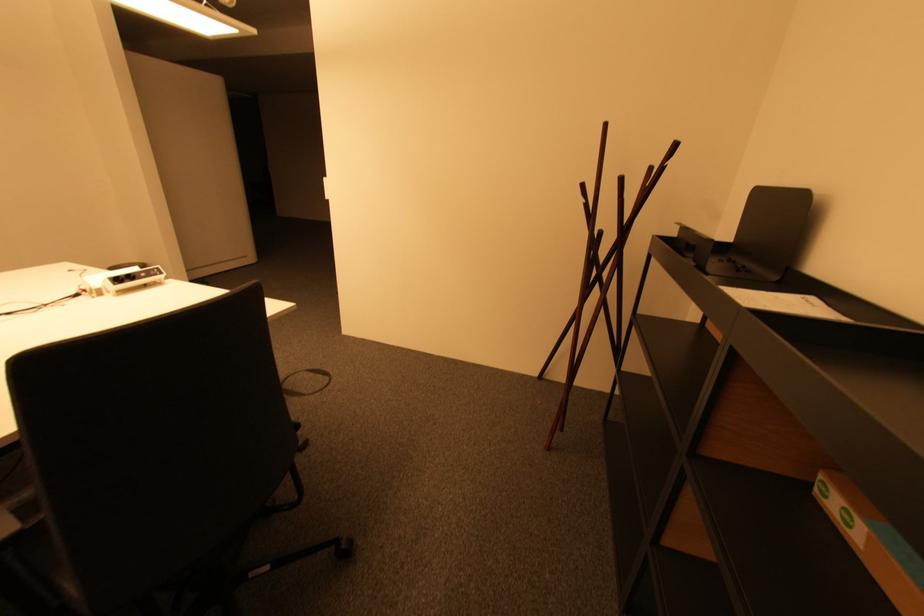
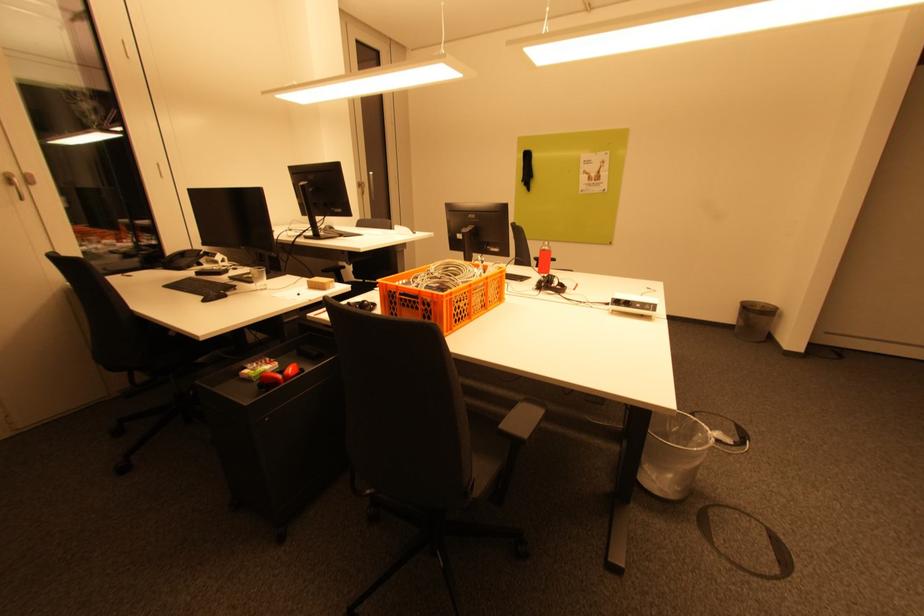
The images are taken continuously from a first-person perspective. In which direction is your viewpoint rotating?

The camera's rotation is toward left-down.